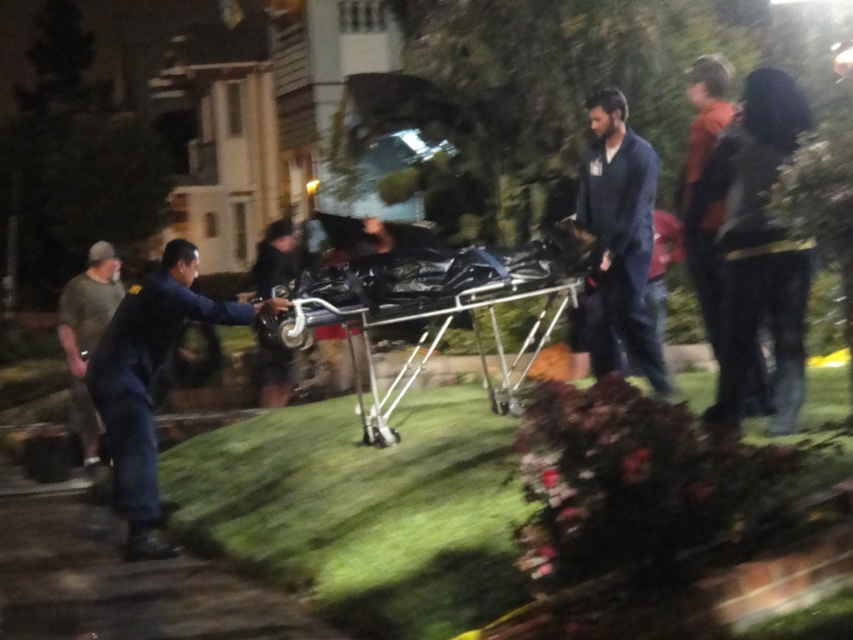
You are a paramedic at the scene and need to locate the blue fabric shirt at center. According to the coordinates given, where exactly would you find it?

The blue fabric shirt at center is located at coordinates point (x=619, y=237).

What is located at the coordinates point (149,381)?

The dark blue uniform at left is located at point (149,381).